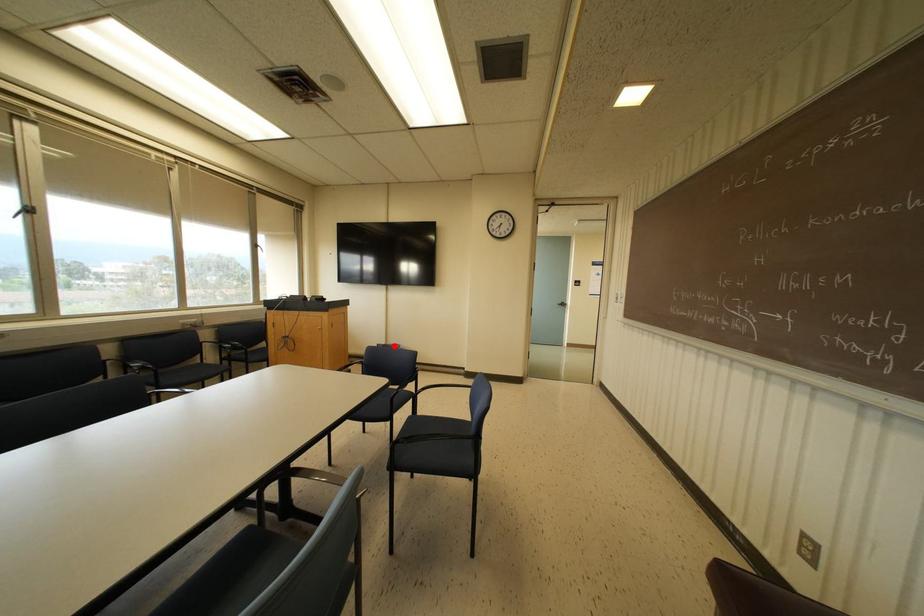
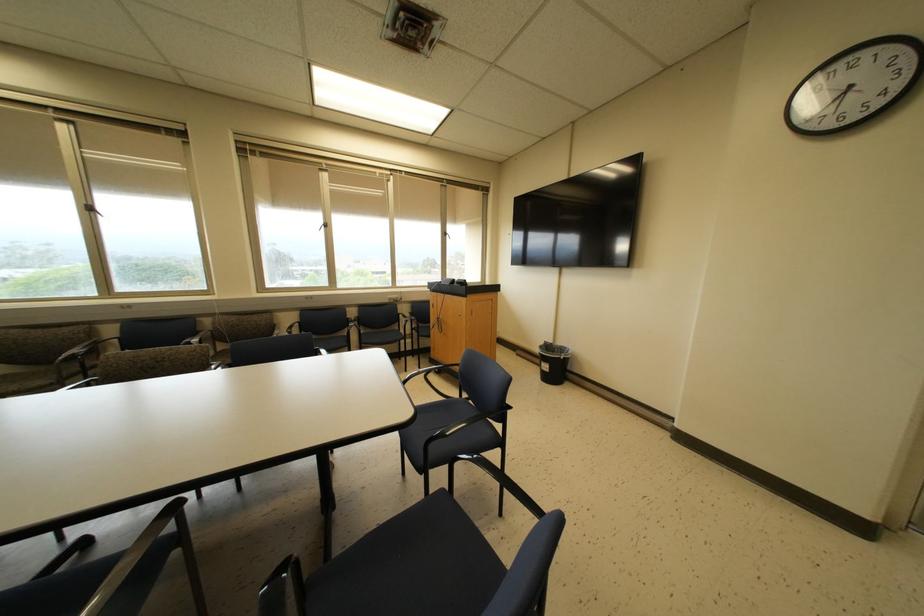
Where in the second image is the point corresponding to the highlighted location from the first image?

(562, 349)